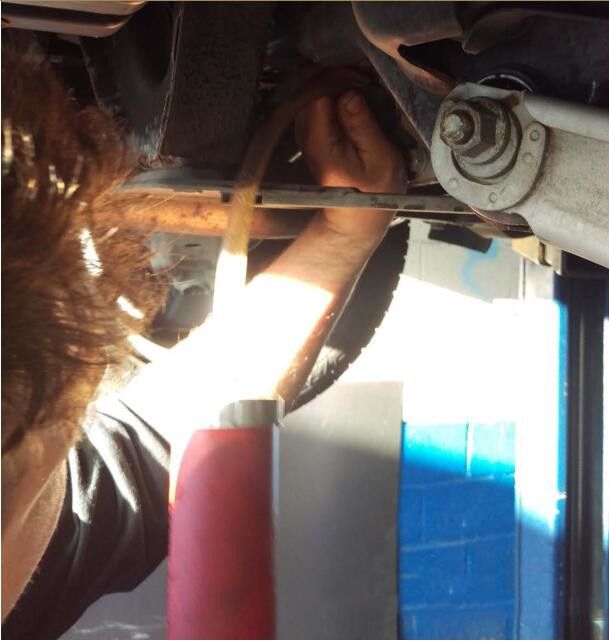
Locate an element on the screen. This screenshot has width=609, height=641. window is located at coordinates (597, 526).